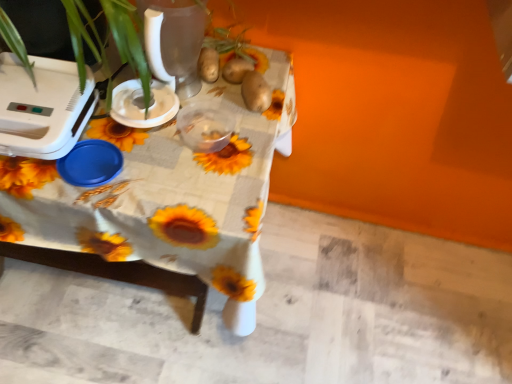
Find the location of `brown matte potato at upper center`. brown matte potato at upper center is located at coordinates (257, 58).

What is the approximate height of white plastic blender at upper left, arranged as the 2th appliance when viewed from the left?

1.68 inches.

Measure the distance between white plastic blender at upper left, arranged as the 2th appliance when viewed from the left, and camera.

The depth of white plastic blender at upper left, arranged as the 2th appliance when viewed from the left, is 34.49 inches.

This screenshot has width=512, height=384. Describe the element at coordinates (158, 202) in the screenshot. I see `sunflower-patterned fabric at center` at that location.

Locate an element on the screen. The height and width of the screenshot is (384, 512). brown matte potato at upper center is located at coordinates (257, 58).

Is brown matte potato at upper center, which appears as the second potato when viewed from the right, beside white plastic blender at upper left, which appears as the first appliance when viewed from the right?

brown matte potato at upper center, which appears as the second potato when viewed from the right, and white plastic blender at upper left, which appears as the first appliance when viewed from the right, are not in contact.

From the image's perspective, is brown matte potato at upper center, which appears as the second potato when viewed from the right, located above or below white plastic blender at upper left, arranged as the 2th appliance when viewed from the left?

From the image's perspective, brown matte potato at upper center, which appears as the second potato when viewed from the right, appears above white plastic blender at upper left, arranged as the 2th appliance when viewed from the left.

In terms of width, does brown matte potato at upper center, which appears as the second potato when viewed from the right, look wider or thinner when compared to white plastic blender at upper left, which appears as the first appliance when viewed from the right?

Considering their sizes, brown matte potato at upper center, which appears as the second potato when viewed from the right, looks slimmer than white plastic blender at upper left, which appears as the first appliance when viewed from the right.

Considering the sizes of objects brown matte potato at upper center, which appears as the second potato when viewed from the right, and white plastic blender at upper left, which appears as the first appliance when viewed from the right, in the image provided, who is bigger, brown matte potato at upper center, which appears as the second potato when viewed from the right, or white plastic blender at upper left, which appears as the first appliance when viewed from the right,?

white plastic blender at upper left, which appears as the first appliance when viewed from the right.

From the image's perspective, between white plastic blender at upper left, arranged as the 2th appliance when viewed from the left, and brown matte potato at upper center, who is located below?

white plastic blender at upper left, arranged as the 2th appliance when viewed from the left.

Is white plastic blender at upper left, which appears as the first appliance when viewed from the right, oriented away from brown matte potato at upper center?

That's not correct — white plastic blender at upper left, which appears as the first appliance when viewed from the right, is not looking away from brown matte potato at upper center.

Is brown matte potato at upper center inside white plastic blender at upper left, which appears as the first appliance when viewed from the right?

No.

Is white plastic blender at upper left, arranged as the 2th appliance when viewed from the left, directly adjacent to brown matte potato at upper center?

No, white plastic blender at upper left, arranged as the 2th appliance when viewed from the left, is not touching brown matte potato at upper center.

Considering the positions of point (278, 104) and point (15, 119), is point (278, 104) closer or farther from the camera than point (15, 119)?

Point (278, 104) is farther from the camera than point (15, 119).

Which object is closer to the camera, sunflower-patterned fabric at center or white plastic appliance at left, the 2th appliance when ordered from right to left?

sunflower-patterned fabric at center is more forward.

Between sunflower-patterned fabric at center and white plastic appliance at left, the first appliance from the left, which one has larger size?

Bigger between the two is sunflower-patterned fabric at center.

Is sunflower-patterned fabric at center touching white plastic appliance at left, the 2th appliance when ordered from right to left?

No, sunflower-patterned fabric at center is not with white plastic appliance at left, the 2th appliance when ordered from right to left.

Which of these two, brown matte potato at center, acting as the 1th potato starting from the right, or white plastic blender at upper left, which appears as the first appliance when viewed from the right, is wider?

white plastic blender at upper left, which appears as the first appliance when viewed from the right.

Could you tell me if brown matte potato at center, acting as the 1th potato starting from the right, is facing white plastic blender at upper left, which appears as the first appliance when viewed from the right?

No, brown matte potato at center, acting as the 1th potato starting from the right, is not aimed at white plastic blender at upper left, which appears as the first appliance when viewed from the right.

From a real-world perspective, does brown matte potato at center, which is the 2th potato in left-to-right order, stand above white plastic blender at upper left, arranged as the 2th appliance when viewed from the left?

Indeed, from a real-world perspective, brown matte potato at center, which is the 2th potato in left-to-right order, stands above white plastic blender at upper left, arranged as the 2th appliance when viewed from the left.

From the picture: Is brown matte potato at center, acting as the 1th potato starting from the right, inside or outside of white plastic blender at upper left, which appears as the first appliance when viewed from the right?

The correct answer is: outside.

Is brown matte potato at upper center at the back of brown matte potato at upper center, which appears as the second potato when viewed from the right?

No, brown matte potato at upper center, which appears as the second potato when viewed from the right, is not facing the opposite direction of brown matte potato at upper center.

From the image's perspective, is brown matte potato at upper center, which ranks as the first potato in left-to-right order, above or below brown matte potato at upper center?

brown matte potato at upper center, which ranks as the first potato in left-to-right order, is above brown matte potato at upper center.

Would you say brown matte potato at upper center, which ranks as the first potato in left-to-right order, is to the left or to the right of brown matte potato at upper center in the picture?

brown matte potato at upper center, which ranks as the first potato in left-to-right order, is to the left of brown matte potato at upper center.

Does point (212, 54) come closer to viewer compared to point (231, 54)?

That is True.

Starting from the sunflower-patterned fabric at center, which appliance is the 2nd one behind? Please provide its 2D coordinates.

[(143, 104)]

Which object is wider, white plastic blender at upper left, which appears as the first appliance when viewed from the right, or sunflower-patterned fabric at center?

sunflower-patterned fabric at center.

In the scene shown: Is white plastic blender at upper left, which appears as the first appliance when viewed from the right, positioned with its back to sunflower-patterned fabric at center?

No, white plastic blender at upper left, which appears as the first appliance when viewed from the right, is not facing away from sunflower-patterned fabric at center.

From the picture: Can you confirm if white plastic blender at upper left, arranged as the 2th appliance when viewed from the left, is shorter than sunflower-patterned fabric at center?

Yes.

What's the angular difference between brown matte potato at center, which is the 2th potato in left-to-right order, and white plastic appliance at left, the 2th appliance when ordered from right to left,'s facing directions?

The angular difference between brown matte potato at center, which is the 2th potato in left-to-right order, and white plastic appliance at left, the 2th appliance when ordered from right to left, is 19.9 degrees.

Is point (269, 98) positioned after point (79, 97)?

Yes.

Considering the positions of objects brown matte potato at center, which is the 2th potato in left-to-right order, and white plastic appliance at left, the 2th appliance when ordered from right to left, in the image provided, who is more to the right, brown matte potato at center, which is the 2th potato in left-to-right order, or white plastic appliance at left, the 2th appliance when ordered from right to left,?

Positioned to the right is brown matte potato at center, which is the 2th potato in left-to-right order.

Looking at the image, does brown matte potato at center, acting as the 1th potato starting from the right, seem bigger or smaller compared to white plastic appliance at left, the 2th appliance when ordered from right to left?

Result: Considering their sizes, brown matte potato at center, acting as the 1th potato starting from the right, takes up less space than white plastic appliance at left, the 2th appliance when ordered from right to left.

Locate an element on the screen. The image size is (512, 384). the 2nd potato behind the white plastic blender at upper left, arranged as the 2th appliance when viewed from the left, counting from the anchor's position is located at coordinates (208, 65).

Find the location of a particular element. This screenshot has height=384, width=512. appliance below the brown matte potato at upper center (from a real-world perspective) is located at coordinates (143, 104).

Estimate the real-world distances between objects in this image. Which object is further from white plastic blender at upper left, which appears as the first appliance when viewed from the right, white plastic appliance at left, the 2th appliance when ordered from right to left, or brown matte potato at center, acting as the 1th potato starting from the right?

The object further to white plastic blender at upper left, which appears as the first appliance when viewed from the right, is brown matte potato at center, acting as the 1th potato starting from the right.

Based on their spatial positions, is brown matte potato at center, acting as the 1th potato starting from the right, or sunflower-patterned fabric at center further from brown matte potato at upper center, which appears as the second potato when viewed from the right?

Among the two, sunflower-patterned fabric at center is located further to brown matte potato at upper center, which appears as the second potato when viewed from the right.

Based on their spatial positions, is white plastic blender at upper left, arranged as the 2th appliance when viewed from the left, or white plastic appliance at left, the 2th appliance when ordered from right to left, further from sunflower-patterned fabric at center?

Among the two, white plastic appliance at left, the 2th appliance when ordered from right to left, is located further to sunflower-patterned fabric at center.

Considering their positions, is sunflower-patterned fabric at center positioned closer to white plastic blender at upper left, arranged as the 2th appliance when viewed from the left, than brown matte potato at upper center, which appears as the second potato when viewed from the right?

brown matte potato at upper center, which appears as the second potato when viewed from the right, lies closer to white plastic blender at upper left, arranged as the 2th appliance when viewed from the left, than the other object.

Based on their spatial positions, is sunflower-patterned fabric at center or white plastic appliance at left, the 2th appliance when ordered from right to left, closer to brown matte potato at upper center, which ranks as the first potato in left-to-right order?

Result: white plastic appliance at left, the 2th appliance when ordered from right to left, lies closer to brown matte potato at upper center, which ranks as the first potato in left-to-right order, than the other object.

Considering their positions, is brown matte potato at upper center, which ranks as the first potato in left-to-right order, positioned closer to brown matte potato at center, acting as the 1th potato starting from the right, than brown matte potato at upper center?

brown matte potato at upper center is closer to brown matte potato at center, acting as the 1th potato starting from the right.

When comparing their distances from brown matte potato at center, acting as the 1th potato starting from the right, does white plastic blender at upper left, arranged as the 2th appliance when viewed from the left, or brown matte potato at upper center seem further?

white plastic blender at upper left, arranged as the 2th appliance when viewed from the left, is positioned further to the anchor brown matte potato at center, acting as the 1th potato starting from the right.

Estimate the real-world distances between objects in this image. Which object is further from white plastic appliance at left, the 2th appliance when ordered from right to left, brown matte potato at upper center, which appears as the second potato when viewed from the right, or white plastic blender at upper left, arranged as the 2th appliance when viewed from the left?

brown matte potato at upper center, which appears as the second potato when viewed from the right, lies further to white plastic appliance at left, the 2th appliance when ordered from right to left, than the other object.

You are a GUI agent. You are given a task and a screenshot of the screen. Output one action in this format:
    pyautogui.click(x=<x>, y=<y>)
    Task: Click on the potato between white plastic appliance at left, the first appliance from the left, and brown matte potato at center, which is the 2th potato in left-to-right order, from left to right
    The width and height of the screenshot is (512, 384).
    Given the screenshot: What is the action you would take?
    pyautogui.click(x=208, y=65)

What are the coordinates of `appliance situated between white plastic appliance at left, the first appliance from the left, and brown matte potato at center, which is the 2th potato in left-to-right order, from left to right` in the screenshot? It's located at (143, 104).

The height and width of the screenshot is (384, 512). I want to click on table between white plastic appliance at left, the 2th appliance when ordered from right to left, and brown matte potato at upper center, which ranks as the first potato in left-to-right order, so click(x=158, y=202).

The image size is (512, 384). Find the location of `potato between white plastic blender at upper left, which appears as the first appliance when viewed from the right, and brown matte potato at center, which is the 2th potato in left-to-right order, from left to right`. potato between white plastic blender at upper left, which appears as the first appliance when viewed from the right, and brown matte potato at center, which is the 2th potato in left-to-right order, from left to right is located at coordinates click(208, 65).